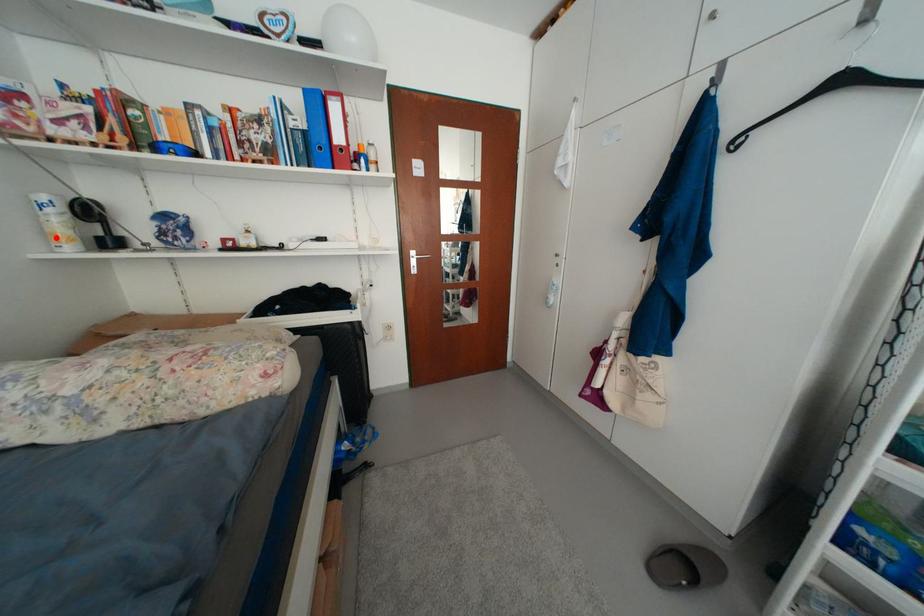
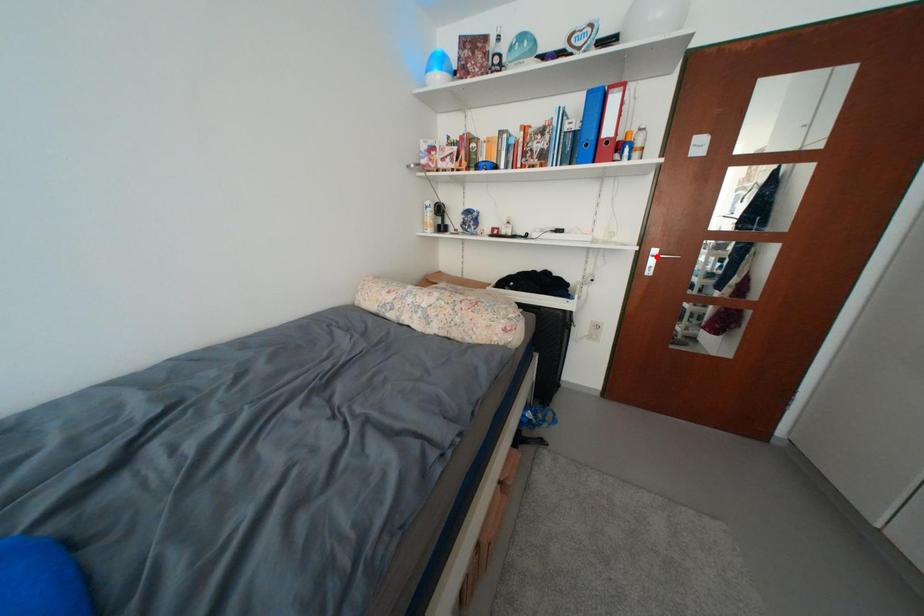
Consider the image. I am providing you with two images of the same scene from different viewpoints. A red point is marked on the first image and another point is marked on the second image. Is the marked point in image1 the same physical position as the marked point in image2?

No